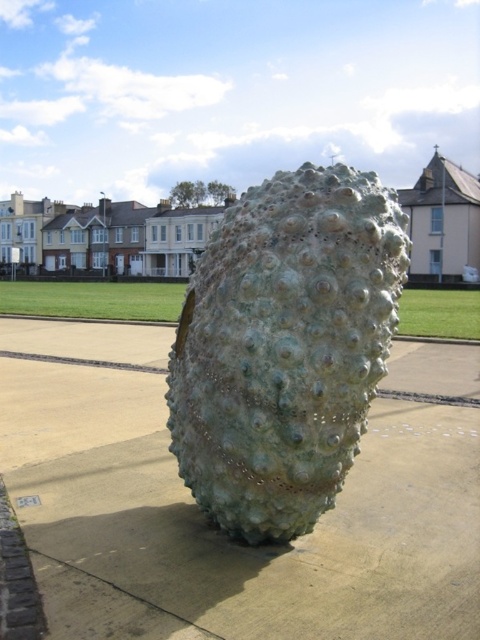
Question: Does greenish concrete at center lie behind green textured sculpture at center?

Choices:
 (A) no
 (B) yes

Answer: (A)

Question: Does greenish concrete at center appear under green textured sculpture at center?

Choices:
 (A) no
 (B) yes

Answer: (B)

Question: Which object is farther from the camera taking this photo?

Choices:
 (A) greenish concrete at center
 (B) green textured sculpture at center

Answer: (B)

Question: Is greenish concrete at center smaller than green textured sculpture at center?

Choices:
 (A) no
 (B) yes

Answer: (A)